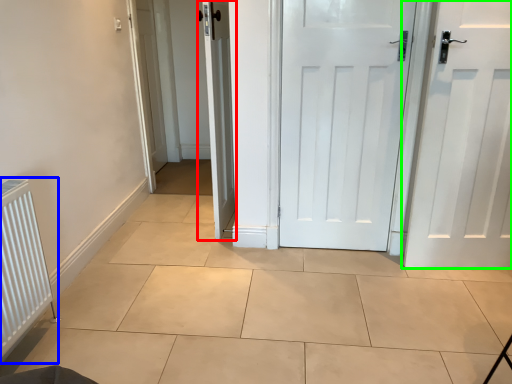
Question: Which object is the farthest from door (highlighted by a red box)? Choose among these: radiator (highlighted by a blue box) or door (highlighted by a green box).

Choices:
 (A) radiator
 (B) door

Answer: (B)